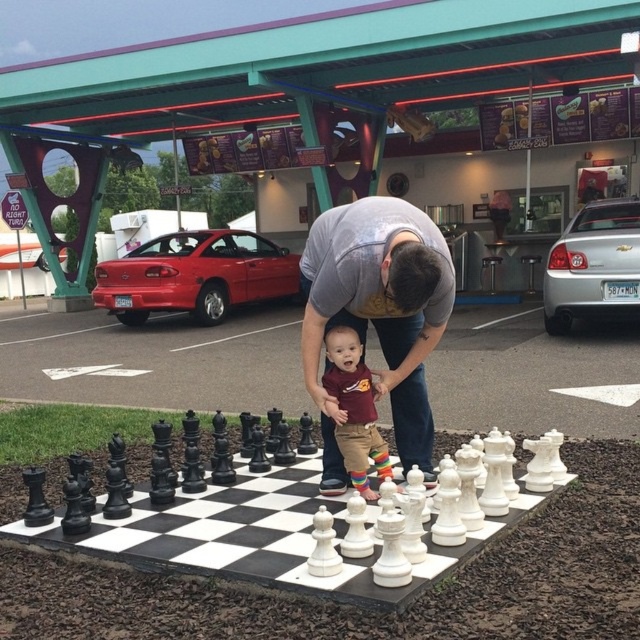
You are standing in front of the chessboard at the drive in restaurant. You see two points marked on the chessboard. Which point is closer to you, point (554, 435) or point (317, 372)?

Point (554, 435) is further to the viewer than point (317, 372), so the closer point to you is point (317, 372).

You are standing at the point with coordinates point (227, 312) and want to walk to the point with coordinates point (445, 468). Which direction should you move in?

You should move forward because point (445, 468) is in front of point (227, 312).